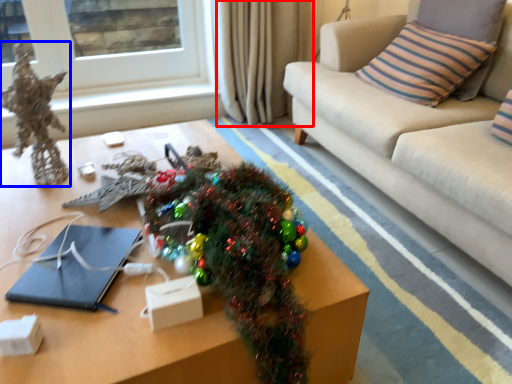
Question: Which of the following is the farthest to the observer, curtain (highlighted by a red box) or decor (highlighted by a blue box)?

Choices:
 (A) curtain
 (B) decor

Answer: (A)